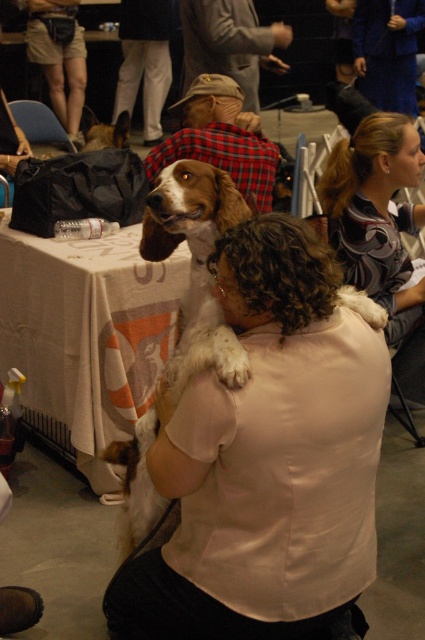
Question: Does brown and white fur at center have a larger size compared to plaid fabric shirt at center?

Choices:
 (A) no
 (B) yes

Answer: (A)

Question: Which object appears farthest from the camera in this image?

Choices:
 (A) plaid fabric shirt at center
 (B) striped fabric shirt at upper right
 (C) brown and white fur at center

Answer: (A)

Question: Which object is closer to the camera taking this photo?

Choices:
 (A) brown and white fur at center
 (B) gray fabric jacket at upper center

Answer: (A)

Question: Is white satin shirt at center closer to the viewer compared to plaid fabric shirt at center?

Choices:
 (A) no
 (B) yes

Answer: (B)

Question: Which of the following is the farthest from the observer?

Choices:
 (A) gray fabric jacket at upper center
 (B) striped fabric shirt at upper right

Answer: (A)

Question: Is white satin shirt at center to the right of gray fabric jacket at upper center from the viewer's perspective?

Choices:
 (A) no
 (B) yes

Answer: (B)